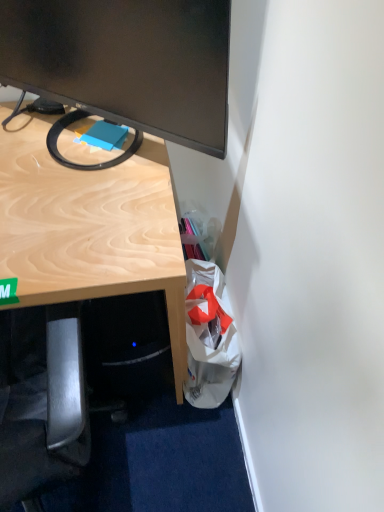
In order to click on white fabric bag at lower right in this screenshot , I will do `click(209, 336)`.

Describe the element at coordinates (209, 336) in the screenshot. The height and width of the screenshot is (512, 384). I see `white fabric bag at lower right` at that location.

The height and width of the screenshot is (512, 384). Describe the element at coordinates (126, 62) in the screenshot. I see `matte black monitor at upper left` at that location.

Locate an element on the screen. The height and width of the screenshot is (512, 384). matte black monitor at upper left is located at coordinates (126, 62).

This screenshot has height=512, width=384. Find the location of `white fabric bag at lower right`. white fabric bag at lower right is located at coordinates (209, 336).

Visually, is white fabric bag at lower right positioned to the left or to the right of matte black monitor at upper left?

From the image, it's evident that white fabric bag at lower right is to the right of matte black monitor at upper left.

Considering the positions of objects white fabric bag at lower right and matte black monitor at upper left in the image provided, who is behind, white fabric bag at lower right or matte black monitor at upper left?

white fabric bag at lower right.

Considering the points (201, 331) and (48, 69), which point is behind, point (201, 331) or point (48, 69)?

Point (201, 331)

From the image's perspective, is white fabric bag at lower right positioned above or below matte black monitor at upper left?

Based on their image positions, white fabric bag at lower right is located beneath matte black monitor at upper left.

From a real-world perspective, is white fabric bag at lower right located beneath matte black monitor at upper left?

Correct, in the physical world, white fabric bag at lower right is lower than matte black monitor at upper left.

Considering the relative sizes of white fabric bag at lower right and matte black monitor at upper left in the image provided, is white fabric bag at lower right thinner than matte black monitor at upper left?

No.

Is white fabric bag at lower right taller or shorter than matte black monitor at upper left?

Clearly, white fabric bag at lower right is shorter compared to matte black monitor at upper left.

Is white fabric bag at lower right smaller than matte black monitor at upper left?

Yes, white fabric bag at lower right is smaller than matte black monitor at upper left.

Is white fabric bag at lower right not inside matte black monitor at upper left?

white fabric bag at lower right lies outside matte black monitor at upper left's area.

Is white fabric bag at lower right placed right next to matte black monitor at upper left?

No, white fabric bag at lower right is not next to matte black monitor at upper left.

Is white fabric bag at lower right aimed at matte black monitor at upper left?

No, white fabric bag at lower right does not turn towards matte black monitor at upper left.

What's the angular difference between white fabric bag at lower right and matte black monitor at upper left's facing directions?

34.8 degrees separate the facing orientations of white fabric bag at lower right and matte black monitor at upper left.

Measure the distance between white fabric bag at lower right and matte black monitor at upper left.

white fabric bag at lower right is 21.05 inches from matte black monitor at upper left.

This screenshot has height=512, width=384. What are the coordinates of `shopping bag below the matte black monitor at upper left (from the image's perspective)` in the screenshot? It's located at (209, 336).

Considering the relative positions of matte black monitor at upper left and white fabric bag at lower right in the image provided, is matte black monitor at upper left to the right of white fabric bag at lower right from the viewer's perspective?

In fact, matte black monitor at upper left is to the left of white fabric bag at lower right.

Based on the photo, considering the positions of objects matte black monitor at upper left and white fabric bag at lower right in the image provided, who is in front, matte black monitor at upper left or white fabric bag at lower right?

matte black monitor at upper left is closer to the camera.

Is point (221, 154) more distant than point (229, 344)?

No.

From the image's perspective, does matte black monitor at upper left appear higher than white fabric bag at lower right?

Yes, from the image's perspective, matte black monitor at upper left is above white fabric bag at lower right.

From a real-world perspective, which is physically above, matte black monitor at upper left or white fabric bag at lower right?

From a 3D spatial view, matte black monitor at upper left is above.

Considering the relative sizes of matte black monitor at upper left and white fabric bag at lower right in the image provided, is matte black monitor at upper left wider than white fabric bag at lower right?

No.

In terms of height, does matte black monitor at upper left look taller or shorter compared to white fabric bag at lower right?

matte black monitor at upper left is taller than white fabric bag at lower right.

Based on their sizes in the image, would you say matte black monitor at upper left is bigger or smaller than white fabric bag at lower right?

matte black monitor at upper left is bigger than white fabric bag at lower right.

Is matte black monitor at upper left located outside white fabric bag at lower right?

Indeed, matte black monitor at upper left is completely outside white fabric bag at lower right.

Is matte black monitor at upper left not near white fabric bag at lower right?

No, matte black monitor at upper left is not far from white fabric bag at lower right.

Is matte black monitor at upper left looking in the opposite direction of white fabric bag at lower right?

matte black monitor at upper left is not turned away from white fabric bag at lower right.

How many degrees apart are the facing directions of matte black monitor at upper left and white fabric bag at lower right?

They differ by 34.8 degrees in their facing directions.

The height and width of the screenshot is (512, 384). What are the coordinates of `shopping bag below the matte black monitor at upper left (from the image's perspective)` in the screenshot? It's located at (209, 336).

Locate an element on the screen. shopping bag below the matte black monitor at upper left (from the image's perspective) is located at coordinates (209, 336).

At what (x,y) coordinates should I click in order to perform the action: click on television above the white fabric bag at lower right (from a real-world perspective). Please return your answer as a coordinate pair (x, y). Looking at the image, I should click on (126, 62).